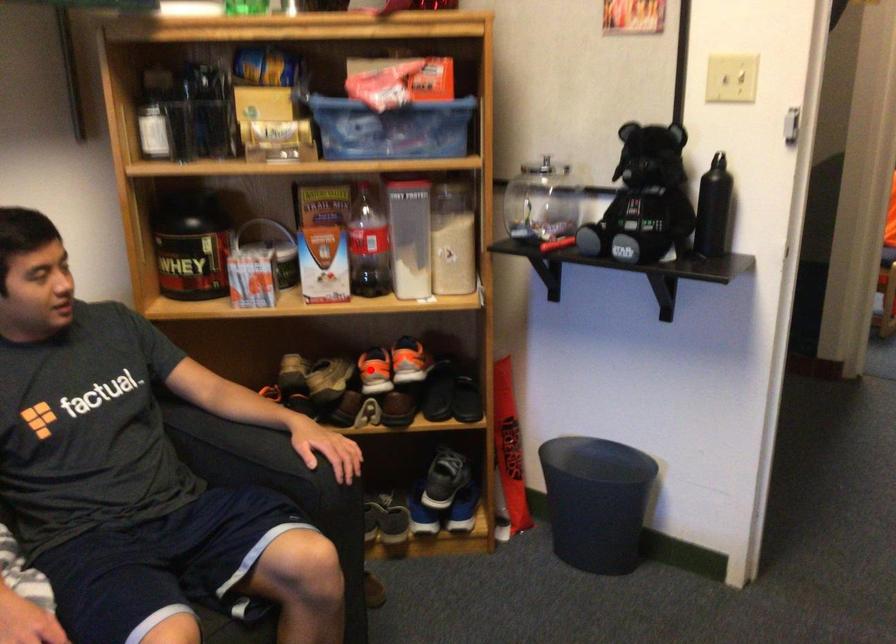
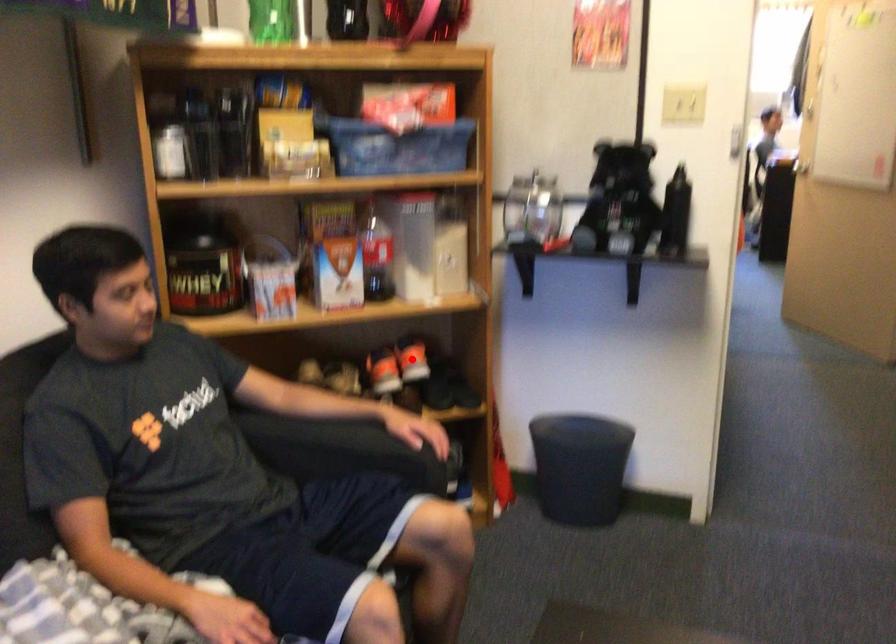
I am providing you with two images of the same scene from different viewpoints. A red point is marked on the first image and another point is marked on the second image. Is the marked point in image1 the same physical position as the marked point in image2?

No